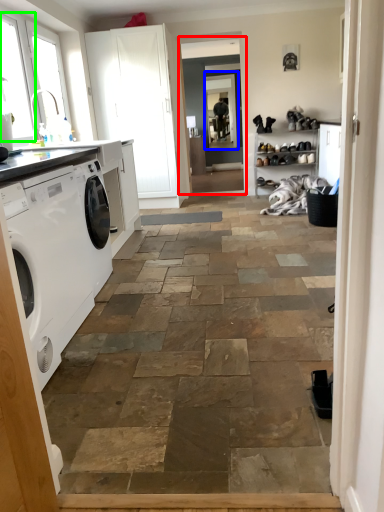
Question: Estimate the real-world distances between objects in this image. Which object is closer to screen door (highlighted by a red box), window screen (highlighted by a blue box) or window (highlighted by a green box)?

Choices:
 (A) window screen
 (B) window

Answer: (A)